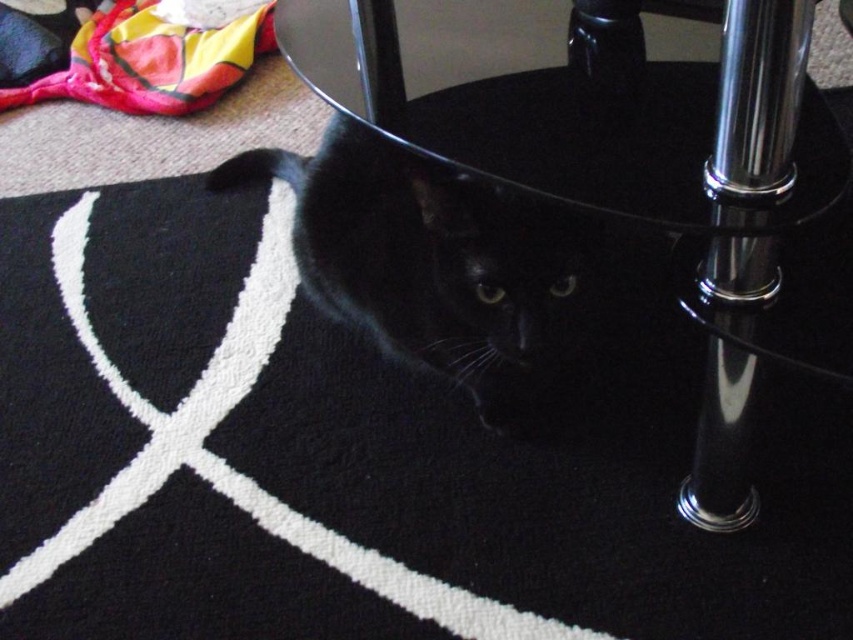
You are a photographer trying to capture the black glossy cat at lower center. The transparent glass table at center is blocking part of the cat. Can you adjust your position to see the entire cat without moving the table?

The transparent glass table at center is taller than the black glossy cat at lower center, so lowering your camera angle or moving to a lower position might allow you to see under the table and capture the entire cat without obstruction.

You are a small toy mouse that is 10 cm long. You are placed on the transparent glass table at center. The black glossy cat at lower center is looking at you. Can you fit entirely on the table without falling off?

The transparent glass table at center might be wider than the black glossy cat at lower center, so there is a possibility that the table is wide enough to accommodate the 10 cm toy mouse. However, without exact measurements, it is uncertain if the mouse will fit entirely without falling off.